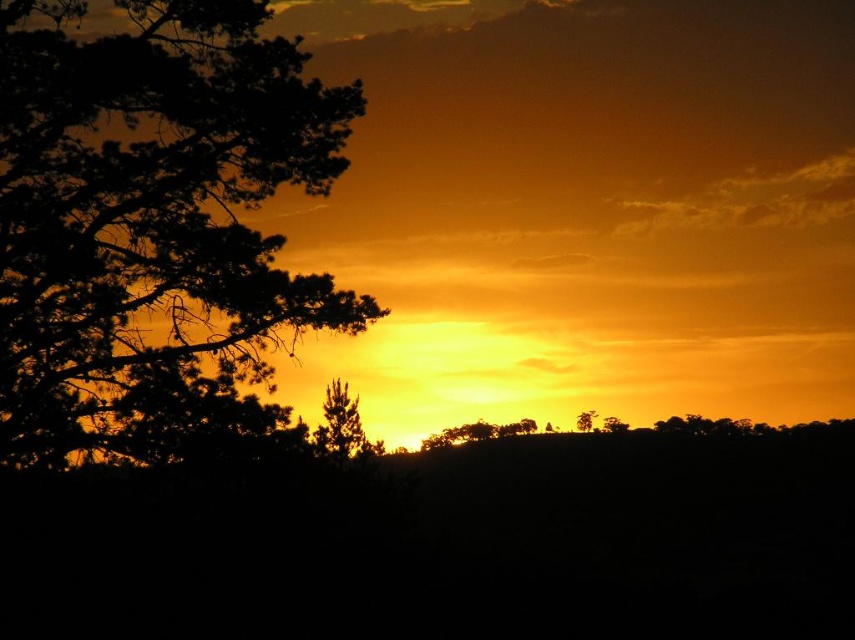
Question: Is green textured pine tree at center bigger than green matte tree at center?

Choices:
 (A) yes
 (B) no

Answer: (A)

Question: Which is nearer to the silhouette bark tree at left?

Choices:
 (A) green textured pine tree at center
 (B) green matte tree at center

Answer: (A)

Question: Is green textured pine tree at center to the right of green matte tree at center from the viewer's perspective?

Choices:
 (A) yes
 (B) no

Answer: (B)

Question: Which object is the closest to the green textured pine tree at center?

Choices:
 (A) green matte tree at center
 (B) silhouette bark tree at left

Answer: (B)

Question: Observing the image, what is the correct spatial positioning of silhouette bark tree at left in reference to green textured pine tree at center?

Choices:
 (A) above
 (B) below

Answer: (A)

Question: Which of the following is the farthest from the observer?

Choices:
 (A) green matte tree at center
 (B) silhouette bark tree at left

Answer: (A)